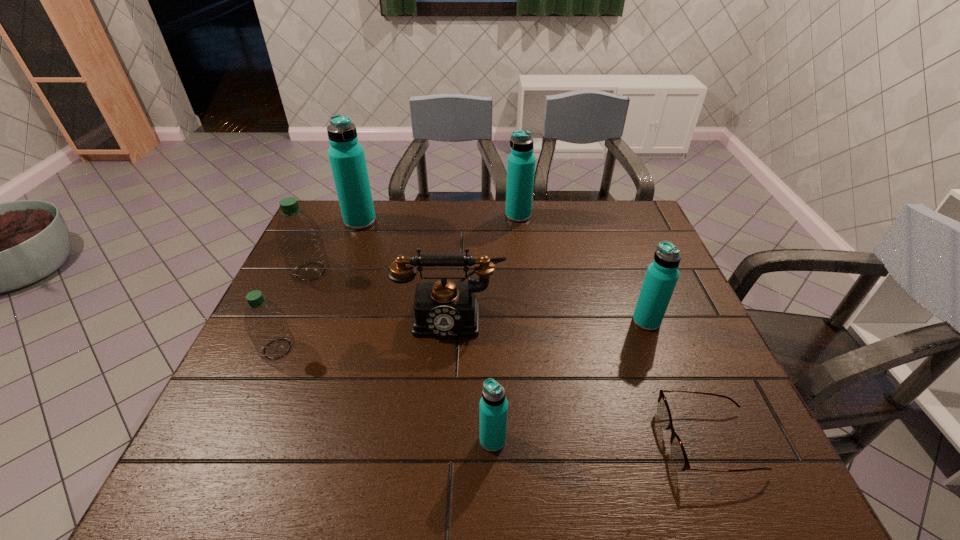
Where is `blue water bottle that is the closest to the smaller green water bottle`? This screenshot has width=960, height=540. blue water bottle that is the closest to the smaller green water bottle is located at coordinates (346, 156).

Identify which blue water bottle is the closest to the third smallest blue water bottle. Please provide its 2D coordinates. Your answer should be formatted as a tuple, i.e. [(x, y)], where the tuple contains the x and y coordinates of a point satisfying the conditions above.

[(346, 156)]